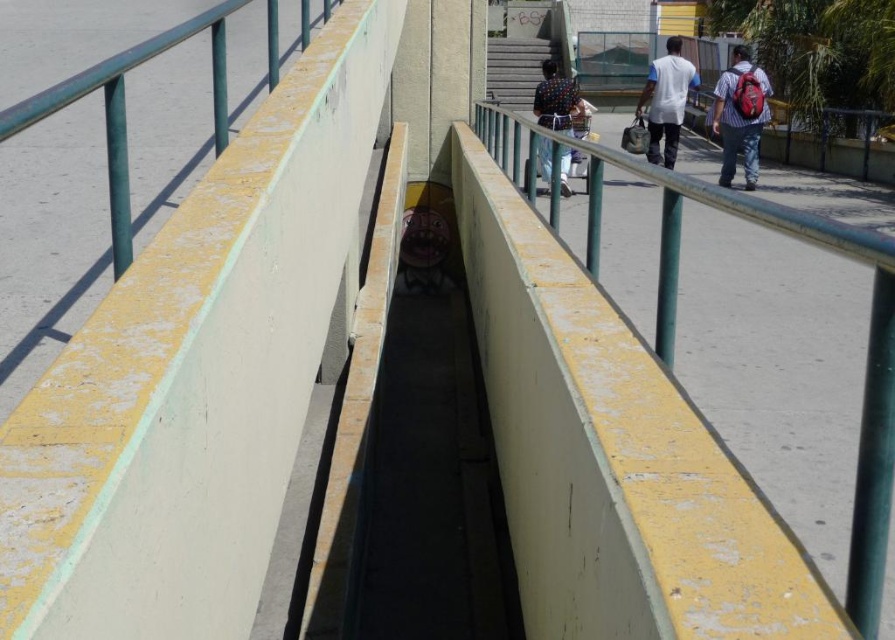
Locate an element on the screen. The height and width of the screenshot is (640, 895). white matte shirt at upper right is located at coordinates (666, 100).

Who is higher up, white matte shirt at upper right or stone stairs at upper center?

stone stairs at upper center

Locate an element on the screen. white matte shirt at upper right is located at coordinates (666, 100).

At what (x,y) coordinates should I click in order to perform the action: click on white matte shirt at upper right. Please return your answer as a coordinate pair (x, y). Image resolution: width=895 pixels, height=640 pixels. Looking at the image, I should click on pos(666,100).

Is white matte shirt at upper right to the right of polka dot shirt at center from the viewer's perspective?

Correct, you'll find white matte shirt at upper right to the right of polka dot shirt at center.

Is point (665, 134) closer to camera compared to point (582, 104)?

Yes, it is in front of point (582, 104).

You are a GUI agent. You are given a task and a screenshot of the screen. Output one action in this format:
    pyautogui.click(x=<x>, y=<y>)
    Task: Click on the white matte shirt at upper right
    The height and width of the screenshot is (640, 895).
    Given the screenshot: What is the action you would take?
    pyautogui.click(x=666, y=100)

Locate an element on the screen. white matte shirt at upper right is located at coordinates (666, 100).

Based on the photo, who is more distant from viewer, (499, 160) or (723, 182)?

The point (723, 182) is more distant.

Consider the image. Measure the distance between yellow painted metal rail at center and camera.

yellow painted metal rail at center is 1.81 meters from camera.

Find the location of a particular element. The height and width of the screenshot is (640, 895). yellow painted metal rail at center is located at coordinates (865, 355).

The image size is (895, 640). What are the coordinates of `yellow painted metal rail at center` in the screenshot? It's located at (865, 355).